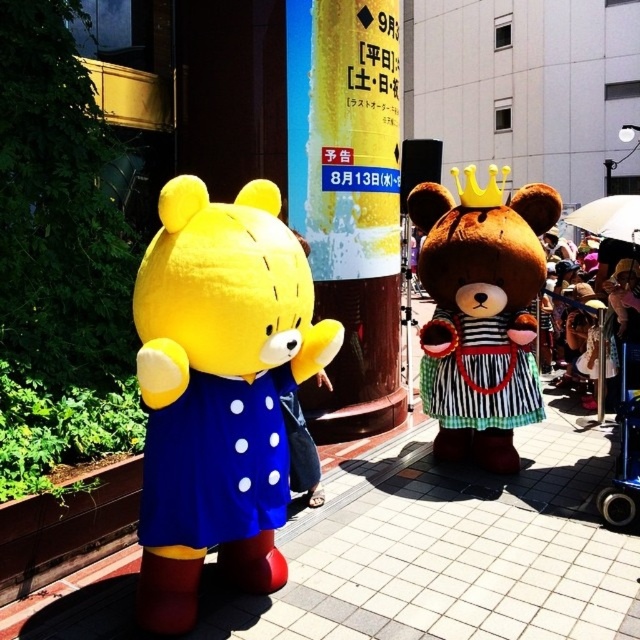
Question: Is yellow fabric signpost at center in front of blue metallic baby carriage at lower right?

Choices:
 (A) no
 (B) yes

Answer: (A)

Question: Which object is closer to the camera taking this photo?

Choices:
 (A) brown plush bear at center
 (B) blue metallic baby carriage at lower right

Answer: (B)

Question: Where is smooth concrete pavement at center located in relation to blue fabric dress at left in the image?

Choices:
 (A) below
 (B) above

Answer: (A)

Question: Which object is closer to the camera taking this photo?

Choices:
 (A) zebra-striped fabric dress at center
 (B) yellow plush bear at left

Answer: (B)

Question: Can you confirm if yellow plush bear at left is positioned above blue fabric dress at left?

Choices:
 (A) no
 (B) yes

Answer: (B)

Question: Which object appears farthest from the camera in this image?

Choices:
 (A) blue metallic baby carriage at lower right
 (B) yellow plush bear at left

Answer: (A)